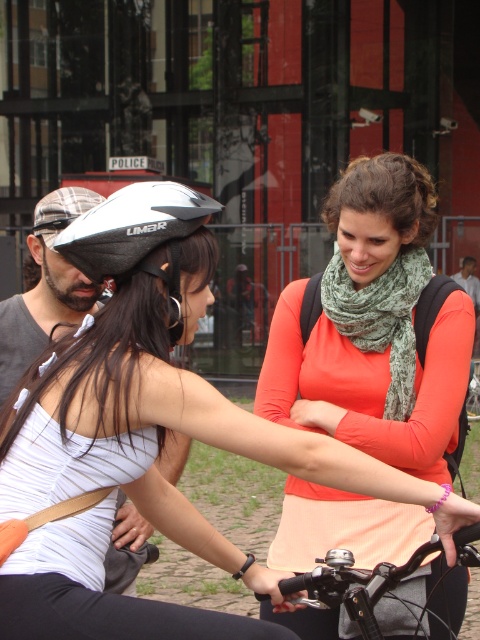
Question: Based on their relative distances, which object is farther from the green textured scarf at center?

Choices:
 (A) dark gray fabric shirt at center
 (B) metallic silver handlebars at center
 (C) silver matte bicycle helmet at center

Answer: (A)

Question: Is white matte helmet at upper left thinner than green textured scarf at center?

Choices:
 (A) no
 (B) yes

Answer: (A)

Question: Is dark gray fabric shirt at center to the right of metallic silver bicycle at center from the viewer's perspective?

Choices:
 (A) no
 (B) yes

Answer: (B)

Question: Which point is farther to the camera?

Choices:
 (A) (73, 218)
 (B) (446, 387)
 (C) (467, 260)
 (D) (335, 320)

Answer: (C)

Question: Can you confirm if metallic silver handlebars at center is wider than silver matte bicycle helmet at center?

Choices:
 (A) no
 (B) yes

Answer: (B)

Question: Considering the real-world distances, which object is closest to the orange matte shirt at center?

Choices:
 (A) silver matte bicycle helmet at center
 (B) metallic silver bicycle at center
 (C) metallic silver handlebars at center

Answer: (C)